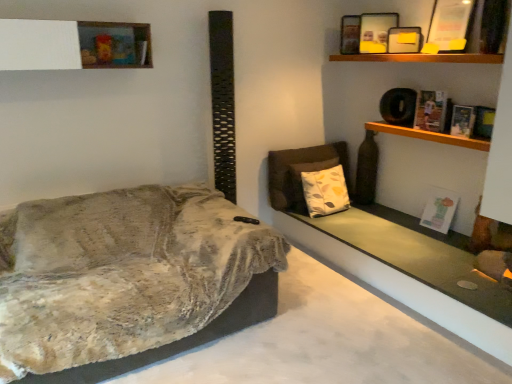
Where is `vacant area located to the right-hand side of velvet beige couch at left`? This screenshot has height=384, width=512. vacant area located to the right-hand side of velvet beige couch at left is located at coordinates (331, 327).